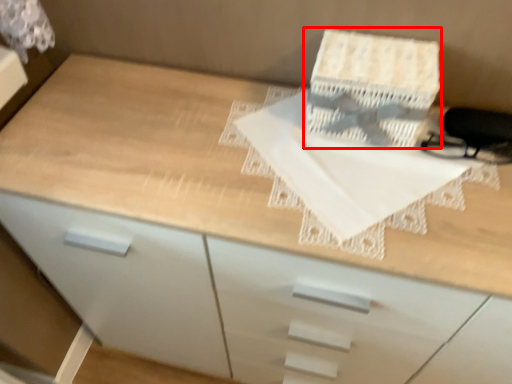
Question: From the image's perspective, considering the relative positions of cardboard box (annotated by the red box) and sheet in the image provided, where is cardboard box (annotated by the red box) located with respect to the staircase?

Choices:
 (A) above
 (B) below

Answer: (A)